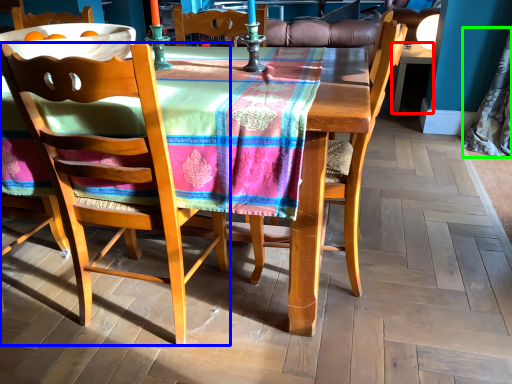
Question: Which object is the closest to the desk (highlighted by a red box)? Choose among these: chair (highlighted by a blue box) or curtain (highlighted by a green box).

Choices:
 (A) chair
 (B) curtain

Answer: (B)